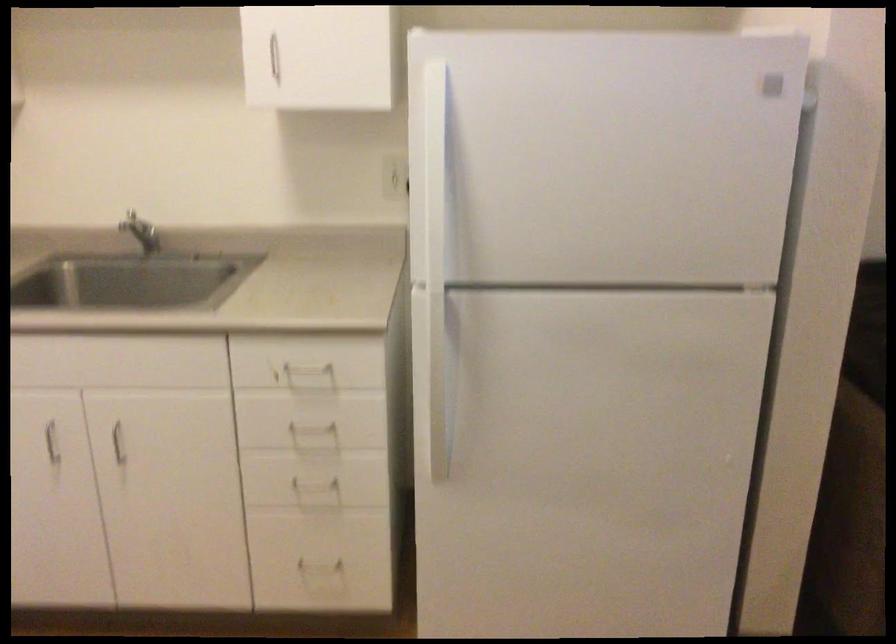
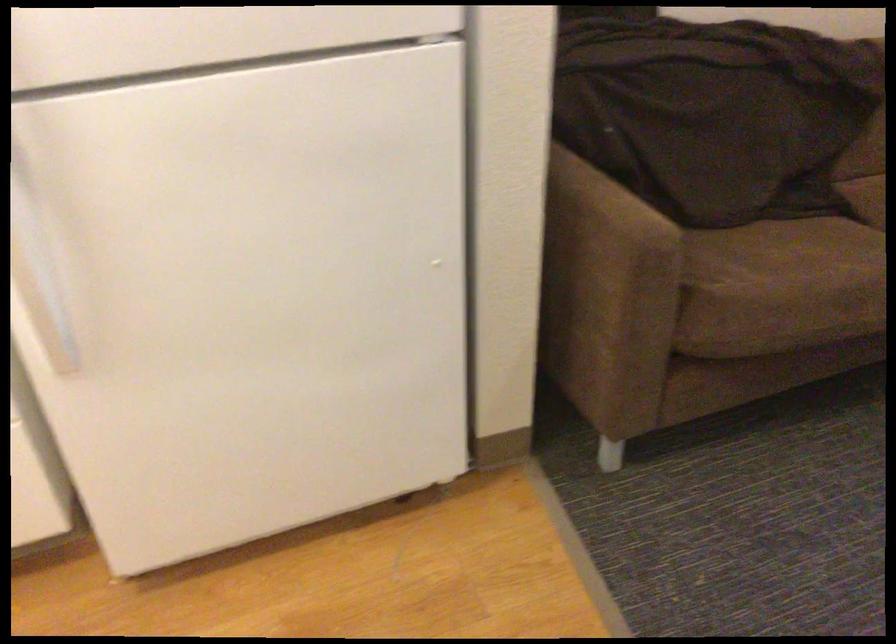
The images are taken continuously from a first-person perspective. In which direction are you moving?

The cameraman moved toward right, forward.